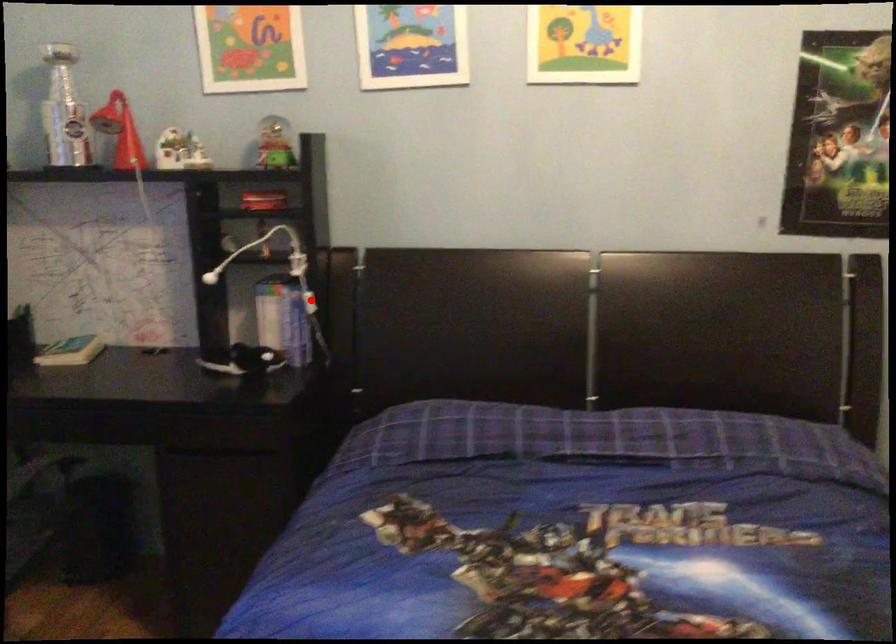
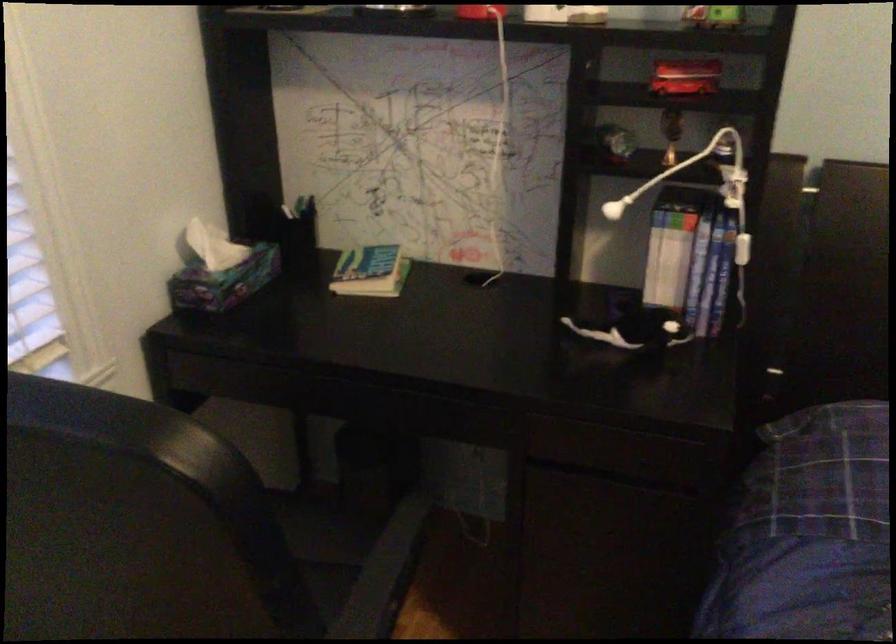
Question: I am providing you with two images of the same scene from different viewpoints. Image1 has a red point marked. In image2, the corresponding 3D location appears at what relative position? Reply with the corresponding letter.

Choices:
 (A) Closer
 (B) Farther

Answer: (A)